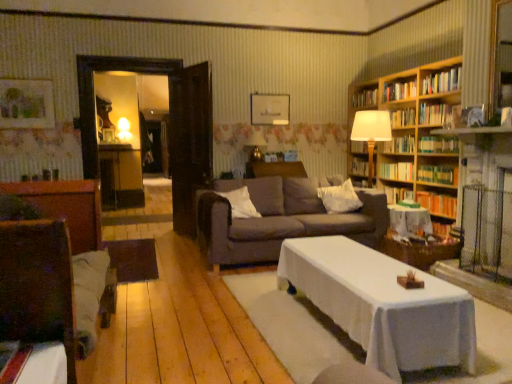
Question: Looking at the image, does white soft pillow at center, marked as the 1th pillow in a left-to-right arrangement, seem bigger or smaller compared to hardcover book at upper right, the seventh book positioned from the bottom?

Choices:
 (A) big
 (B) small

Answer: (A)

Question: From the image's perspective, relative to hardcover book at upper right, the seventh book positioned from the bottom, is white soft pillow at center, marked as the 1th pillow in a left-to-right arrangement, above or below?

Choices:
 (A) above
 (B) below

Answer: (B)

Question: Which is nearer to the hardcover book at upper right, the 5th book viewed from the top?

Choices:
 (A) white soft pillow at center, placed as the second pillow when sorted from right to left
 (B) hardcover book at center, which is counted as the eighth book, starting from the top
 (C) wooden bookshelf at right
 (D) matte yellow lampshade at upper left, acting as the first lamp starting from the top
 (E) hardcover book at upper right, the 1th book viewed from the top

Answer: (B)

Question: Which of these objects is positioned closest to the hardcover book at upper right, placed as the 11th book when sorted from bottom to top?

Choices:
 (A) white cloth-covered table at center
 (B) wooden swivel chair at left
 (C) matte white picture frame at upper center
 (D) wooden bookshelf at right
 (E) dark brown fabric couch at center

Answer: (D)